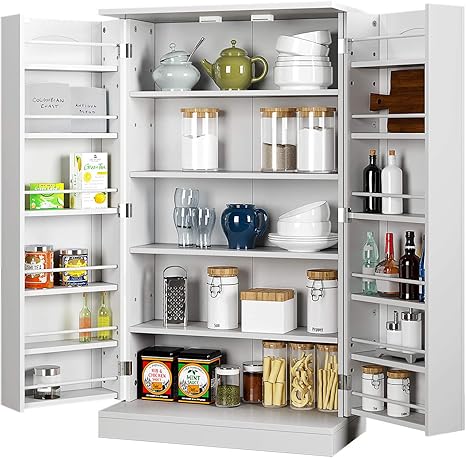
This screenshot has width=466, height=458. In order to click on items on bottom shelf in center in this screenshot , I will do `click(153, 388)`, `click(187, 383)`, `click(220, 388)`, `click(245, 382)`, `click(275, 388)`, `click(295, 388)`, `click(317, 385)`.